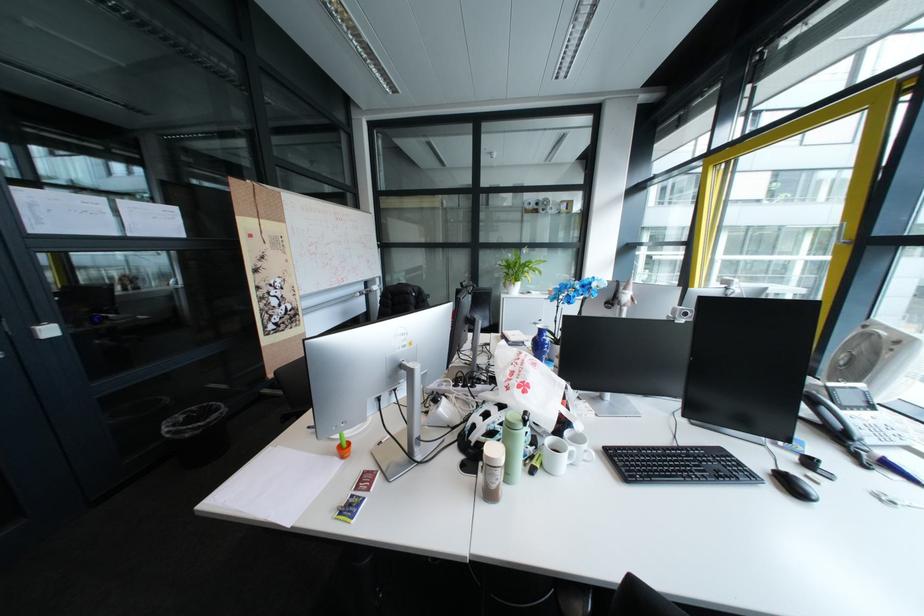
The image size is (924, 616). Identify the location of green water bottle. (513, 445).